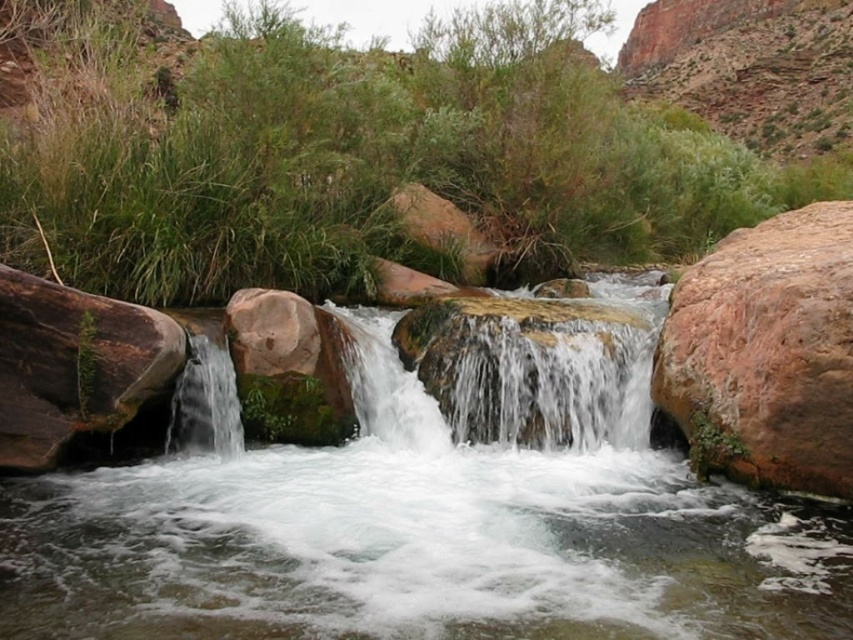
You are standing at the edge of the stream and want to place a small pebble on the clear water at center so that it floats. However, you need to ensure it won not be carried away by the current. Which direction should you place it relative to the green grass at upper center?

You should place the pebble under the green grass at upper center, as the clear water at center is positioned under it, and the current flows downward away from the grass, so placing it there would keep it from being carried away.

You are standing at the edge of the stream and want to reach the green grass at upper center. Which direction should you move to get closer to it without crossing the clear water at left?

You should move away from the clear water at left towards the green grass at upper center since the green grass at upper center is closer to you than the clear water at left.